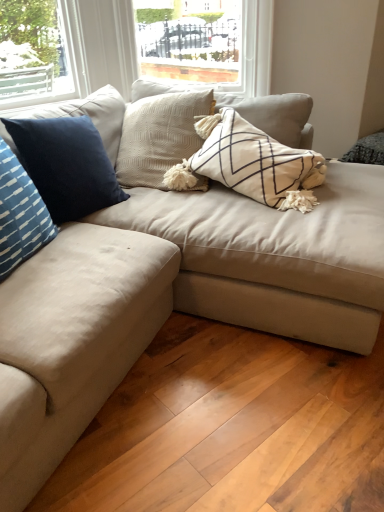
Describe the element at coordinates (275, 256) in the screenshot. This screenshot has height=512, width=384. I see `suede beige couch at center` at that location.

The height and width of the screenshot is (512, 384). Describe the element at coordinates (20, 214) in the screenshot. I see `blue striped pillow at left, the 1th pillow viewed from the front` at that location.

Find the location of a particular element. The height and width of the screenshot is (512, 384). blue velvet pillow at left, the 2th pillow in the front-to-back sequence is located at coordinates (66, 165).

Can you see blue striped pillow at left, the 1th pillow viewed from the front, touching blue velvet pillow at left, which ranks as the first pillow in back-to-front order?

No, blue striped pillow at left, the 1th pillow viewed from the front, is not beside blue velvet pillow at left, which ranks as the first pillow in back-to-front order.

Based on the photo, can you tell me how much blue striped pillow at left, the 1th pillow viewed from the front, and blue velvet pillow at left, which ranks as the first pillow in back-to-front order, differ in facing direction?

They differ by 11.8 degrees in their facing directions.

Which object is further away from the camera taking this photo, blue striped pillow at left, arranged as the second pillow when viewed from the back, or blue velvet pillow at left, which ranks as the first pillow in back-to-front order?

blue velvet pillow at left, which ranks as the first pillow in back-to-front order, is further away from the camera.

Considering the positions of objects blue striped pillow at left, arranged as the second pillow when viewed from the back, and blue velvet pillow at left, which ranks as the first pillow in back-to-front order, in the image provided, who is more to the left, blue striped pillow at left, arranged as the second pillow when viewed from the back, or blue velvet pillow at left, which ranks as the first pillow in back-to-front order,?

blue striped pillow at left, arranged as the second pillow when viewed from the back.

From the image's perspective, is blue velvet pillow at left, the 2th pillow in the front-to-back sequence, below suede beige couch at center?

Actually, blue velvet pillow at left, the 2th pillow in the front-to-back sequence, appears above suede beige couch at center in the image.

Is blue velvet pillow at left, the 2th pillow in the front-to-back sequence, aimed at suede beige couch at center?

Yes, blue velvet pillow at left, the 2th pillow in the front-to-back sequence, is aimed at suede beige couch at center.

From a real-world perspective, which pillow is the 1st one above the suede beige couch at center? Please provide its 2D coordinates.

[(66, 165)]

How many degrees apart are the facing directions of blue striped pillow at left, arranged as the second pillow when viewed from the back, and suede beige couch at center?

The angle between the facing direction of blue striped pillow at left, arranged as the second pillow when viewed from the back, and the facing direction of suede beige couch at center is 97.5 degrees.

Which object is wider, blue striped pillow at left, arranged as the second pillow when viewed from the back, or suede beige couch at center?

Wider between the two is suede beige couch at center.

Is suede beige couch at center a part of blue striped pillow at left, the 1th pillow viewed from the front?

No.

From the image's perspective, does blue striped pillow at left, the 1th pillow viewed from the front, appear higher than suede beige couch at center?

Actually, blue striped pillow at left, the 1th pillow viewed from the front, appears below suede beige couch at center in the image.

The image size is (384, 512). I want to click on studio couch located underneath the blue velvet pillow at left, the 2th pillow in the front-to-back sequence (from a real-world perspective), so click(275, 256).

From a real-world perspective, who is located lower, suede beige couch at center or blue velvet pillow at left, which ranks as the first pillow in back-to-front order?

suede beige couch at center.

Do you think suede beige couch at center is within blue velvet pillow at left, which ranks as the first pillow in back-to-front order, or outside of it?

suede beige couch at center is outside blue velvet pillow at left, which ranks as the first pillow in back-to-front order.

Does suede beige couch at center have a greater width compared to blue velvet pillow at left, which ranks as the first pillow in back-to-front order?

Correct, the width of suede beige couch at center exceeds that of blue velvet pillow at left, which ranks as the first pillow in back-to-front order.

Where is `pillow lying below the suede beige couch at center (from the image's perspective)`? This screenshot has height=512, width=384. pillow lying below the suede beige couch at center (from the image's perspective) is located at coordinates (20, 214).

Based on the photo, visually, is suede beige couch at center positioned to the left or to the right of blue striped pillow at left, arranged as the second pillow when viewed from the back?

suede beige couch at center is positioned on blue striped pillow at left, arranged as the second pillow when viewed from the back,'s right side.

Who is more distant, suede beige couch at center or blue striped pillow at left, the 1th pillow viewed from the front?

suede beige couch at center is further away from the camera.

Considering the relative sizes of suede beige couch at center and blue striped pillow at left, arranged as the second pillow when viewed from the back, in the image provided, is suede beige couch at center bigger than blue striped pillow at left, arranged as the second pillow when viewed from the back,?

Yes, suede beige couch at center is bigger than blue striped pillow at left, arranged as the second pillow when viewed from the back.

Can you tell me how much blue velvet pillow at left, the 2th pillow in the front-to-back sequence, and blue striped pillow at left, arranged as the second pillow when viewed from the back, differ in facing direction?

blue velvet pillow at left, the 2th pillow in the front-to-back sequence, and blue striped pillow at left, arranged as the second pillow when viewed from the back, are facing 11.8 degrees away from each other.

Would you say blue velvet pillow at left, which ranks as the first pillow in back-to-front order, is a long distance from blue striped pillow at left, arranged as the second pillow when viewed from the back?

No.

From the picture: Who is taller, blue velvet pillow at left, which ranks as the first pillow in back-to-front order, or blue striped pillow at left, arranged as the second pillow when viewed from the back?

Standing taller between the two is blue velvet pillow at left, which ranks as the first pillow in back-to-front order.

Between blue velvet pillow at left, the 2th pillow in the front-to-back sequence, and blue striped pillow at left, the 1th pillow viewed from the front, which one has larger size?

blue velvet pillow at left, the 2th pillow in the front-to-back sequence.

The image size is (384, 512). There is a blue velvet pillow at left, the 2th pillow in the front-to-back sequence. What are the coordinates of `pillow above it (from a real-world perspective)` in the screenshot? It's located at (20, 214).

Where is `studio couch in front of the blue velvet pillow at left, the 2th pillow in the front-to-back sequence`? This screenshot has height=512, width=384. studio couch in front of the blue velvet pillow at left, the 2th pillow in the front-to-back sequence is located at coordinates [275, 256].

Which object lies nearer to the anchor point blue velvet pillow at left, the 2th pillow in the front-to-back sequence, blue striped pillow at left, the 1th pillow viewed from the front, or suede beige couch at center?

The object closer to blue velvet pillow at left, the 2th pillow in the front-to-back sequence, is blue striped pillow at left, the 1th pillow viewed from the front.

Looking at the image, which one is located further to blue striped pillow at left, the 1th pillow viewed from the front, suede beige couch at center or blue velvet pillow at left, the 2th pillow in the front-to-back sequence?

Based on the image, suede beige couch at center appears to be further to blue striped pillow at left, the 1th pillow viewed from the front.

Looking at this image, which object lies further to the anchor point blue velvet pillow at left, which ranks as the first pillow in back-to-front order, suede beige couch at center or blue striped pillow at left, the 1th pillow viewed from the front?

suede beige couch at center lies further to blue velvet pillow at left, which ranks as the first pillow in back-to-front order, than the other object.

Estimate the real-world distances between objects in this image. Which object is further from suede beige couch at center, blue velvet pillow at left, the 2th pillow in the front-to-back sequence, or blue striped pillow at left, arranged as the second pillow when viewed from the back?

Among the two, blue striped pillow at left, arranged as the second pillow when viewed from the back, is located further to suede beige couch at center.

Considering their positions, is blue striped pillow at left, arranged as the second pillow when viewed from the back, positioned further to suede beige couch at center than blue velvet pillow at left, the 2th pillow in the front-to-back sequence?

Based on the image, blue striped pillow at left, arranged as the second pillow when viewed from the back, appears to be further to suede beige couch at center.

Which object lies nearer to the anchor point blue striped pillow at left, the 1th pillow viewed from the front, blue velvet pillow at left, the 2th pillow in the front-to-back sequence, or suede beige couch at center?

blue velvet pillow at left, the 2th pillow in the front-to-back sequence, lies closer to blue striped pillow at left, the 1th pillow viewed from the front, than the other object.

This screenshot has height=512, width=384. In order to click on pillow located between blue striped pillow at left, arranged as the second pillow when viewed from the back, and suede beige couch at center in the left-right direction in this screenshot , I will do `click(66, 165)`.